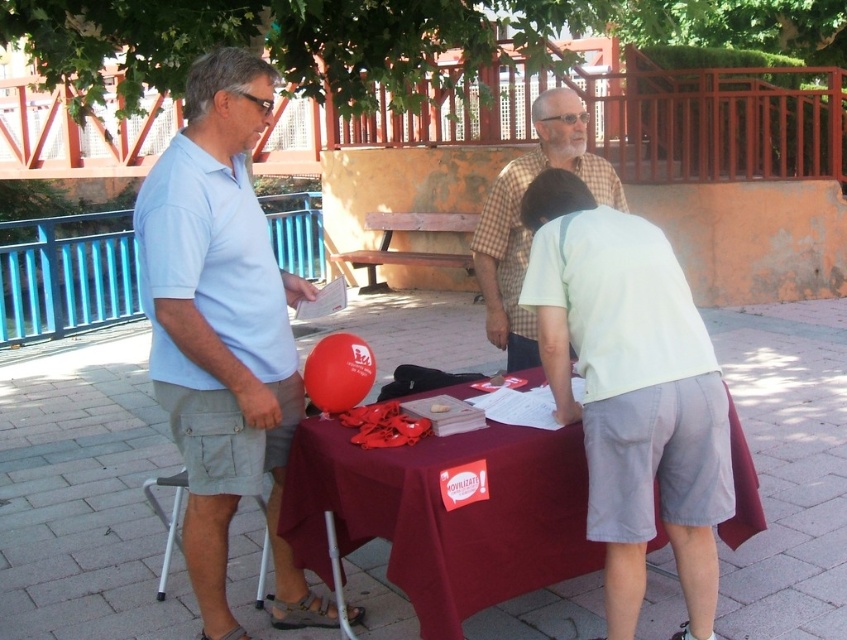
Is checkered fabric shirt at center to the right of brown wooden bench at center from the viewer's perspective?

Indeed, checkered fabric shirt at center is positioned on the right side of brown wooden bench at center.

Is checkered fabric shirt at center in front of brown wooden bench at center?

Yes, it is in front of brown wooden bench at center.

Locate an element on the screen. This screenshot has width=847, height=640. checkered fabric shirt at center is located at coordinates (522, 225).

Can you confirm if maroon fabric table at center is positioned to the left of checkered fabric shirt at center?

Correct, you'll find maroon fabric table at center to the left of checkered fabric shirt at center.

Can you confirm if maroon fabric table at center is smaller than checkered fabric shirt at center?

Yes.

Is point (501, 540) farther from camera compared to point (535, 122)?

No, (501, 540) is closer to viewer.

Identify the location of maroon fabric table at center. (444, 515).

Who is taller, brown wooden bench at center or light gray plastic stool at lower left?

brown wooden bench at center

Is brown wooden bench at center closer to camera compared to light gray plastic stool at lower left?

No, it is behind light gray plastic stool at lower left.

This screenshot has height=640, width=847. What are the coordinates of `brown wooden bench at center` in the screenshot? It's located at (407, 250).